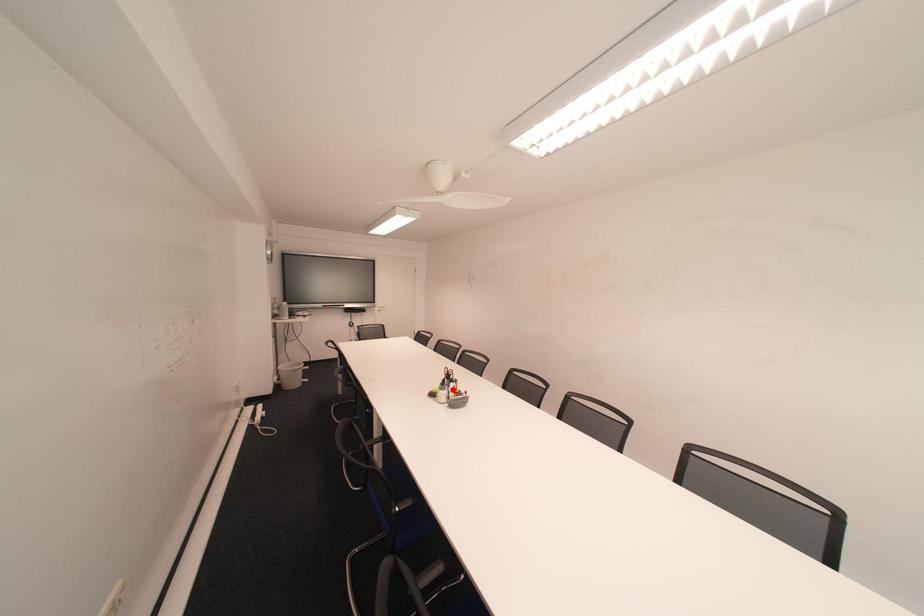
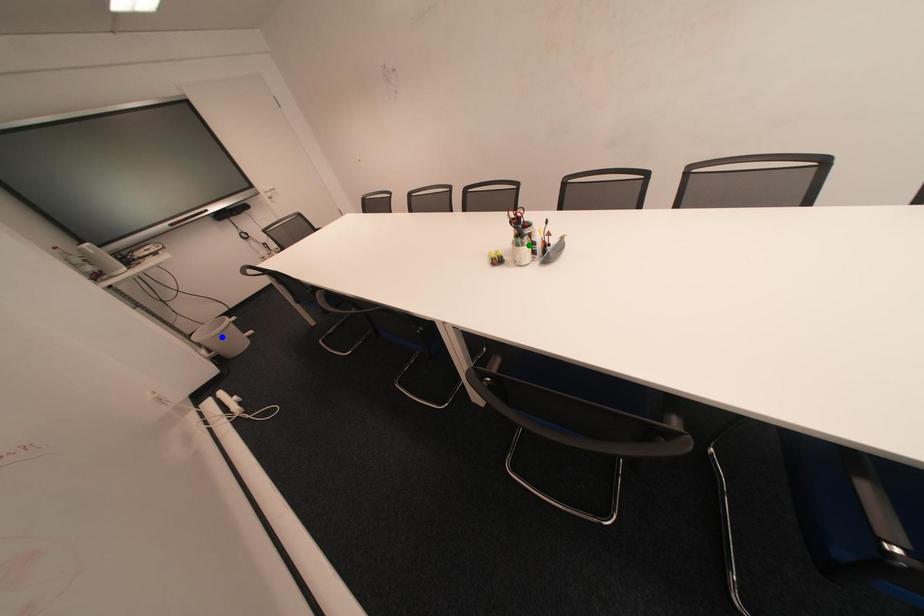
Question: I am providing you with two images of the same scene from different viewpoints. A red point is marked on the first image. You are given multiple points on the second image. Which spot in image 2 lines up with the point in image 1?

Choices:
 (A) green point
 (B) yellow point
 (C) blue point

Answer: (A)